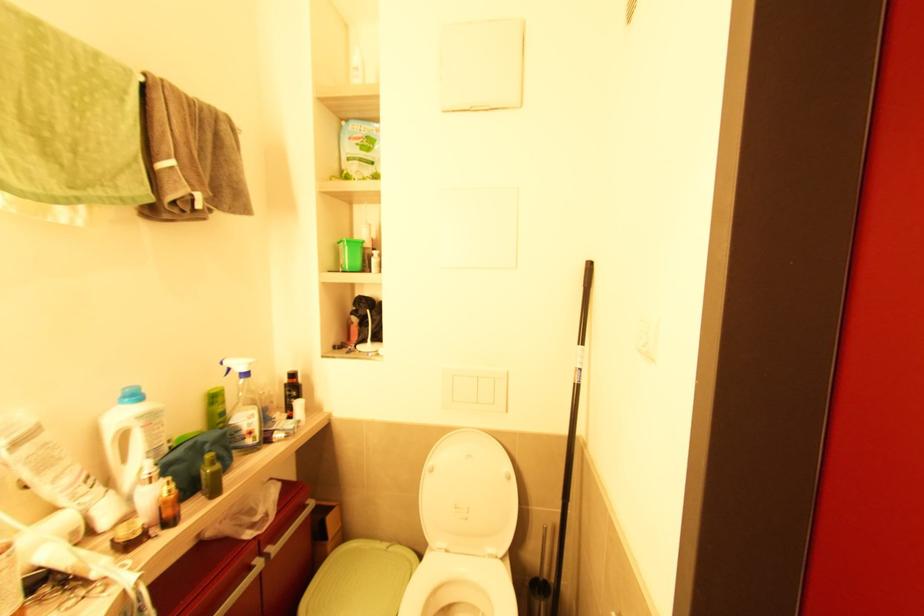
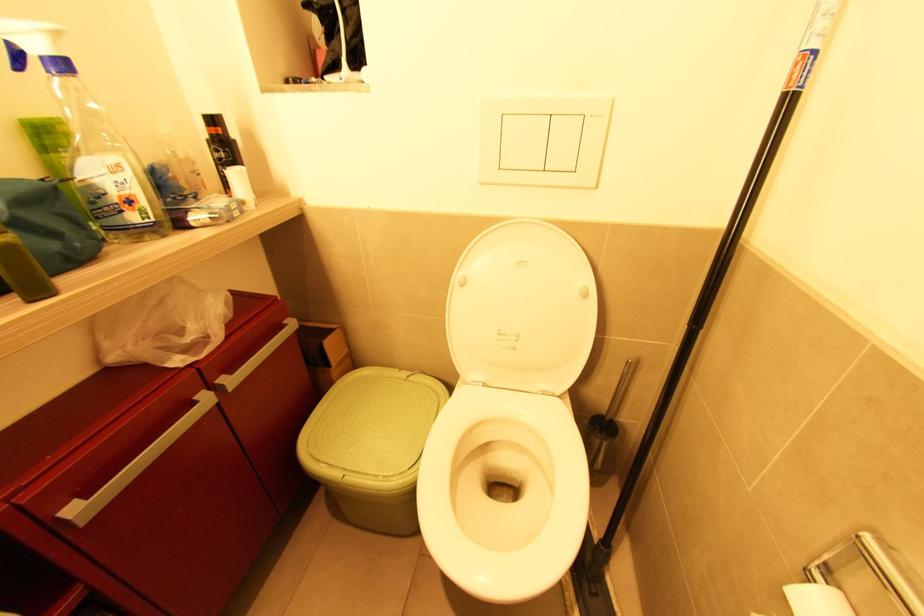
Question: How did the camera likely rotate?

Choices:
 (A) Left
 (B) Right
 (C) Up
 (D) Down

Answer: (D)